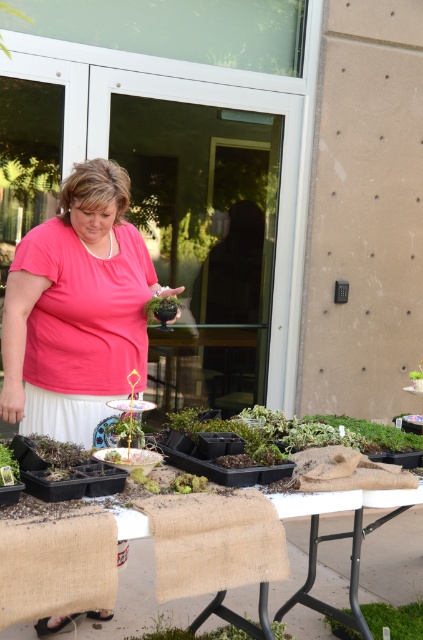
Question: Which point is farther to the camera?

Choices:
 (A) pos(84,564)
 (B) pos(403,630)
 (C) pos(11,452)
 (D) pos(272,621)

Answer: (D)

Question: Does green mossy plant at lower center have a lesser width compared to green matte pot at center?

Choices:
 (A) yes
 (B) no

Answer: (B)

Question: Which object is closer to the camera taking this photo?

Choices:
 (A) pink matte shirt at center
 (B) green matte pot at center
 (C) green mossy plant at lower center

Answer: (A)

Question: Which point is farther from the camera taking this photo?

Choices:
 (A) (87, 602)
 (B) (154, 305)
 (C) (107, 192)
 (D) (412, 604)

Answer: (D)

Question: Does green mossy plant at lower right appear on the right side of green mossy plant at lower center?

Choices:
 (A) yes
 (B) no

Answer: (A)

Question: Where is pink matte shirt at center located in relation to green matte pot at center in the image?

Choices:
 (A) above
 (B) below

Answer: (A)